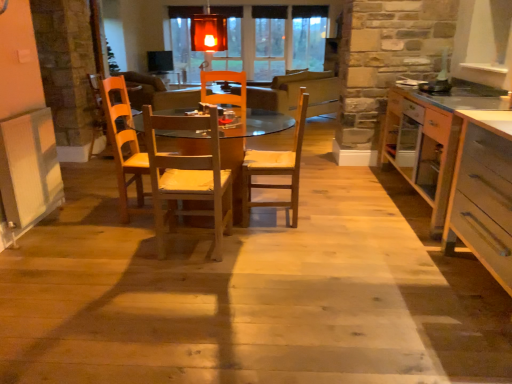
What is the approximate height of light wood drawer at right?

35.06 inches.

Find the location of a particular element. The image size is (512, 384). wooden armchair at left is located at coordinates (96, 110).

What is the approximate height of light brown wooden chair at center, marked as the second chair in a left-to-right arrangement?

light brown wooden chair at center, marked as the second chair in a left-to-right arrangement, is 37.64 inches tall.

This screenshot has width=512, height=384. What do you see at coordinates (188, 178) in the screenshot? I see `wooden chair at center, the second chair viewed from the right` at bounding box center [188, 178].

The height and width of the screenshot is (384, 512). What are the coordinates of `wooden table at center` in the screenshot? It's located at (170, 166).

Image resolution: width=512 pixels, height=384 pixels. I want to click on light wood drawer at right, so click(x=483, y=193).

From the image's perspective, which one is positioned lower, white laminate countertop at right or wooden armchair at left?

white laminate countertop at right.

At what (x,y) coordinates should I click in order to perform the action: click on countertop above the wooden armchair at left (from a real-world perspective). Please return your answer as a coordinate pair (x, y). Looking at the image, I should click on (428, 140).

Considering the relative sizes of white laminate countertop at right and wooden armchair at left in the image provided, is white laminate countertop at right smaller than wooden armchair at left?

Incorrect, white laminate countertop at right is not smaller in size than wooden armchair at left.

Is white laminate countertop at right not inside wooden armchair at left?

Yes, white laminate countertop at right is outside of wooden armchair at left.

From a real-world perspective, is light wood drawer at right positioned over wooden table at center based on gravity?

Indeed, from a real-world perspective, light wood drawer at right stands above wooden table at center.

Considering the relative sizes of light wood drawer at right and wooden table at center in the image provided, is light wood drawer at right taller than wooden table at center?

Yes.

From the image's perspective, which one is positioned lower, light wood drawer at right or wooden table at center?

light wood drawer at right appears lower in the image.

Considering the relative positions of light wood drawer at right and wooden table at center in the image provided, is light wood drawer at right to the right of wooden table at center from the viewer's perspective?

Yes, light wood drawer at right is to the right of wooden table at center.

What's the angular difference between wooden armchair at left and wooden table at center's facing directions?

The angular difference between wooden armchair at left and wooden table at center is 92.2 degrees.

Is wooden armchair at left oriented away from wooden table at center?

No, wooden armchair at left is not facing away from wooden table at center.

Considering the positions of point (88, 76) and point (146, 162), is point (88, 76) closer or farther from the camera than point (146, 162)?

Point (88, 76) is farther from the camera than point (146, 162).

Where is `armchair above the wooden table at center (from a real-world perspective)`? The height and width of the screenshot is (384, 512). armchair above the wooden table at center (from a real-world perspective) is located at coordinates (96, 110).

Is wooden armchair at left thinner than wooden chair at center, the 1th chair from the left?

No.

Is wooden armchair at left looking in the opposite direction of wooden chair at center, the 1th chair from the left?

No.

From the image's perspective, between wooden armchair at left and wooden chair at center, the 1th chair from the left, which one is located above?

wooden armchair at left.

Who is smaller, wooden armchair at left or light brown wooden chair at center, placed as the first chair when sorted from right to left?

light brown wooden chair at center, placed as the first chair when sorted from right to left.

Is the surface of wooden armchair at left in direct contact with light brown wooden chair at center, marked as the second chair in a left-to-right arrangement?

No.

Does point (92, 79) come closer to viewer compared to point (267, 151)?

No, (92, 79) is behind (267, 151).

Considering the relative sizes of wooden armchair at left and light brown wooden chair at center, placed as the first chair when sorted from right to left, in the image provided, is wooden armchair at left taller than light brown wooden chair at center, placed as the first chair when sorted from right to left,?

No.

Is wooden table at center to the right of wooden armchair at left from the viewer's perspective?

Indeed, wooden table at center is positioned on the right side of wooden armchair at left.

Is wooden table at center in contact with wooden armchair at left?

No, wooden table at center is not making contact with wooden armchair at left.

In the scene shown: How many degrees apart are the facing directions of wooden table at center and wooden armchair at left?

92.2 degrees separate the facing orientations of wooden table at center and wooden armchair at left.

Is wooden table at center looking in the opposite direction of light wood drawer at right?

No, wooden table at center is not facing away from light wood drawer at right.

Which is more to the left, wooden table at center or light wood drawer at right?

From the viewer's perspective, wooden table at center appears more on the left side.

Is point (185, 155) closer or farther from the camera than point (457, 156)?

Point (185, 155) is positioned closer to the camera compared to point (457, 156).

Image resolution: width=512 pixels, height=384 pixels. Identify the location of countertop below the wooden armchair at left (from the image's perspective). (428, 140).

Where is `cabinetry lying on the right of wooden table at center`? cabinetry lying on the right of wooden table at center is located at coordinates (483, 193).

Based on their spatial positions, is light brown wooden chair at center, placed as the first chair when sorted from right to left, or light wood drawer at right closer to wooden armchair at left?

light brown wooden chair at center, placed as the first chair when sorted from right to left, is positioned closer to the anchor wooden armchair at left.

Which object lies further to the anchor point wooden chair at center, the second chair viewed from the right, light wood drawer at right or wooden table at center?

light wood drawer at right lies further to wooden chair at center, the second chair viewed from the right, than the other object.

Which object lies further to the anchor point white laminate countertop at right, light wood drawer at right or light brown wooden chair at center, marked as the second chair in a left-to-right arrangement?

light brown wooden chair at center, marked as the second chair in a left-to-right arrangement.

Estimate the real-world distances between objects in this image. Which object is further from light wood drawer at right, wooden table at center or wooden armchair at left?

wooden armchair at left is further to light wood drawer at right.

From the image, which object appears to be farther from wooden table at center, white laminate countertop at right or wooden chair at center, the second chair viewed from the right?

white laminate countertop at right is positioned further to the anchor wooden table at center.

Looking at the image, which one is located closer to wooden table at center, wooden armchair at left or wooden chair at center, the 1th chair from the left?

Among the two, wooden chair at center, the 1th chair from the left, is located nearer to wooden table at center.

Looking at the image, which one is located closer to light brown wooden chair at center, placed as the first chair when sorted from right to left, light wood drawer at right or wooden armchair at left?

The object closer to light brown wooden chair at center, placed as the first chair when sorted from right to left, is light wood drawer at right.

Considering their positions, is wooden chair at center, the 1th chair from the left, positioned further to light brown wooden chair at center, placed as the first chair when sorted from right to left, than light wood drawer at right?

light wood drawer at right lies further to light brown wooden chair at center, placed as the first chair when sorted from right to left, than the other object.

Where is `kitchen & dining room table between wooden armchair at left and white laminate countertop at right in the horizontal direction`? The height and width of the screenshot is (384, 512). kitchen & dining room table between wooden armchair at left and white laminate countertop at right in the horizontal direction is located at coordinates (170, 166).

Identify the location of chair between wooden table at center and light wood drawer at right from left to right. The height and width of the screenshot is (384, 512). (276, 169).

Where is `kitchen & dining room table situated between wooden chair at center, the 1th chair from the left, and white laminate countertop at right from left to right`? This screenshot has width=512, height=384. kitchen & dining room table situated between wooden chair at center, the 1th chair from the left, and white laminate countertop at right from left to right is located at coordinates (170, 166).

What are the coordinates of `cabinetry between wooden table at center and white laminate countertop at right from left to right` in the screenshot? It's located at (483, 193).